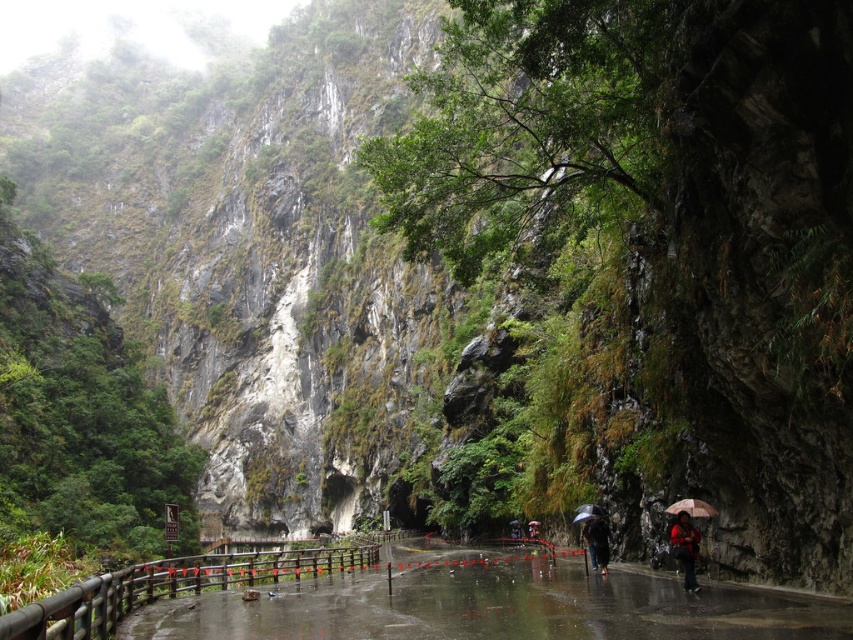
Question: Which point is farther to the camera?

Choices:
 (A) red umbrella at center
 (B) dark brown umbrella at center
 (C) transparent plastic umbrella at center

Answer: (A)

Question: Does transparent plastic umbrella at center have a smaller size compared to red umbrella at center?

Choices:
 (A) yes
 (B) no

Answer: (B)

Question: Among these points, which one is farthest from the camera?

Choices:
 (A) (534, 528)
 (B) (537, 634)
 (C) (598, 506)
 (D) (596, 522)

Answer: (A)

Question: Does dark brown umbrella at center have a smaller size compared to brown matte umbrella at lower right?

Choices:
 (A) no
 (B) yes

Answer: (A)

Question: Does wet asphalt path at center have a smaller size compared to dark brown umbrella at center?

Choices:
 (A) yes
 (B) no

Answer: (B)

Question: Which of the following is the closest to the observer?

Choices:
 (A) brown matte umbrella at lower right
 (B) red umbrella at center

Answer: (A)